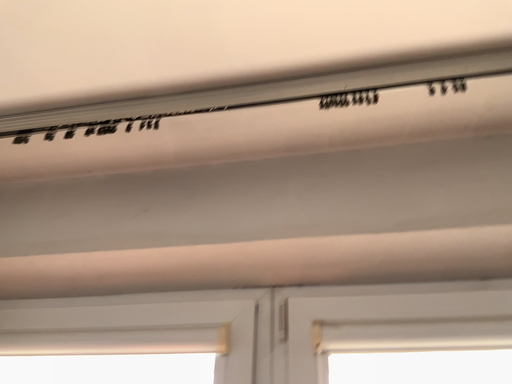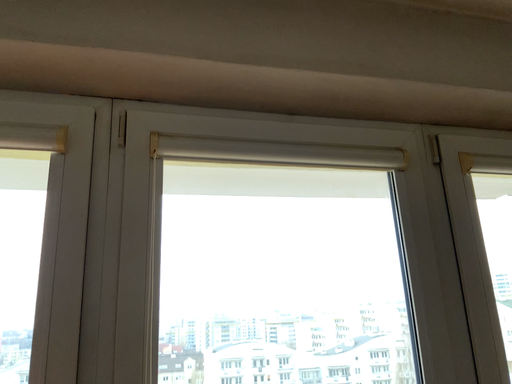
Question: How did the camera likely rotate when shooting the video?

Choices:
 (A) rotated left
 (B) rotated right

Answer: (B)